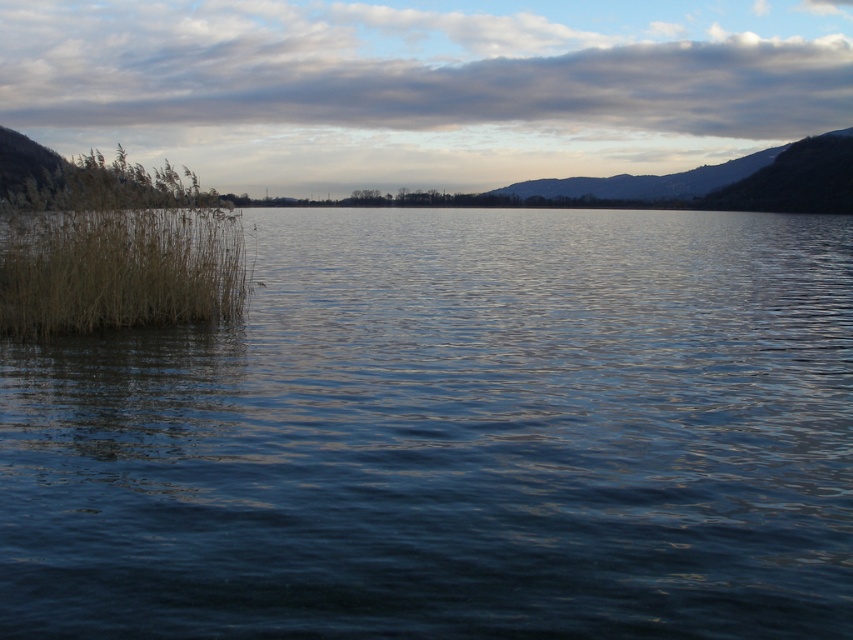
In the serene lakeside scene, there is a point marked at coordinates (114, 252). What object is located at this point?

The point at (114, 252) indicates brown grass at left.